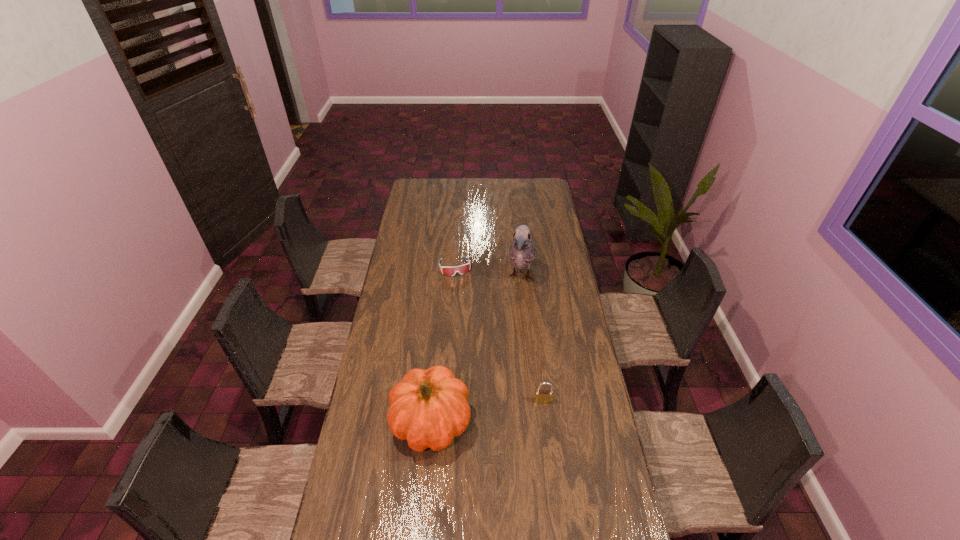
I want to click on free space that satisfies the following two spatial constraints: 1. on the back side of the second tallest object; 2. on the left side of the parrot, so click(444, 278).